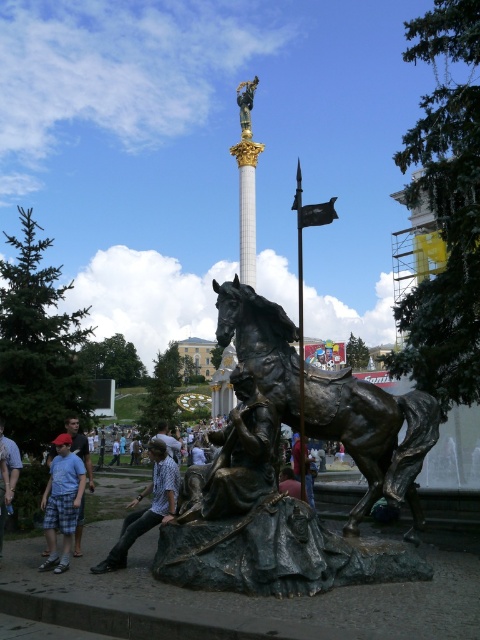
What do you see at coordinates (373, 436) in the screenshot? I see `bronze metallic horse at center` at bounding box center [373, 436].

Which is below, bronze metallic horse at center or gold polished statue at upper center?

bronze metallic horse at center

Who is more distant from viewer, (346, 417) or (241, 136)?

The point (241, 136) is more distant.

Identify the location of bronze metallic horse at center. Image resolution: width=480 pixels, height=640 pixels. (373, 436).

Is plaid shirt at lower center to the right of light blue denim jeans at lower center from the viewer's perspective?

Incorrect, plaid shirt at lower center is not on the right side of light blue denim jeans at lower center.

Is plaid shirt at lower center below light blue denim jeans at lower center?

Indeed, plaid shirt at lower center is positioned under light blue denim jeans at lower center.

Between point (165, 497) and point (156, 433), which one is positioned behind?

The point (156, 433) is more distant.

I want to click on plaid shirt at lower center, so click(146, 508).

The image size is (480, 640). In order to click on bronze spear at center in this screenshot , I will do `click(300, 324)`.

Measure the distance from bronze spear at center to light blue denim jeans at lower center.

bronze spear at center and light blue denim jeans at lower center are 131.19 feet apart from each other.

Measure the distance between point (x=301, y=240) and camera.

Point (x=301, y=240) is 167.87 meters from camera.

What are the coordinates of `bronze spear at center` in the screenshot? It's located at (300, 324).